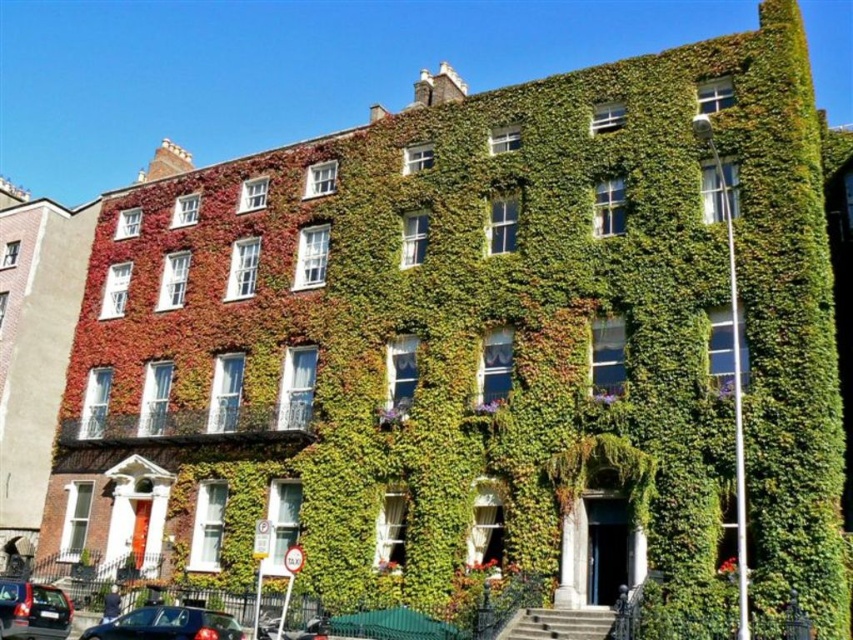
You are a delivery person trying to park your vehicle in front of the ivy covered building. You see a shiny black car at lower left and a metallic gray sedan at lower left. Which vehicle is closer to the entrance of the building?

The shiny black car at lower left is positioned on the right side of metallic gray sedan at lower left. Since the entrance is likely near the center of the building, the metallic gray sedan at lower left is closer to the entrance.

You are a delivery person approaching the building and need to park your vehicle. You see a shiny black car at lower left and a metallic gray sedan at lower left. Which vehicle is parked closer to the entrance of the building?

The metallic gray sedan at lower left is parked closer to the entrance because the shiny black car at lower left is positioned above it, indicating it is further away from the entrance.

You are a delivery person trying to park your van between the shiny black car at lower left and the metallic gray sedan at lower left. The van is 2.5 meters wide. Can you fit your van between them?

The shiny black car at lower left might be wider than metallic gray sedan at lower left, so it is uncertain if there is enough space for the van. Check the actual width before attempting to park.